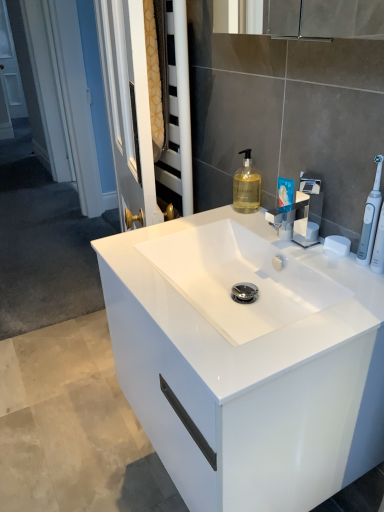
What are the coordinates of `free point in front of blue glossy toothpaste tube at upper right` in the screenshot? It's located at (332, 268).